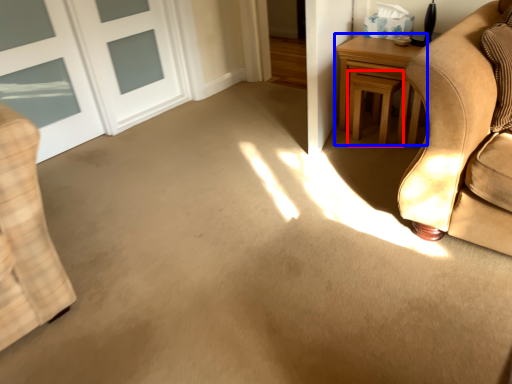
Question: Which object is further to the camera taking this photo, stool (highlighted by a red box) or table (highlighted by a blue box)?

Choices:
 (A) stool
 (B) table

Answer: (A)